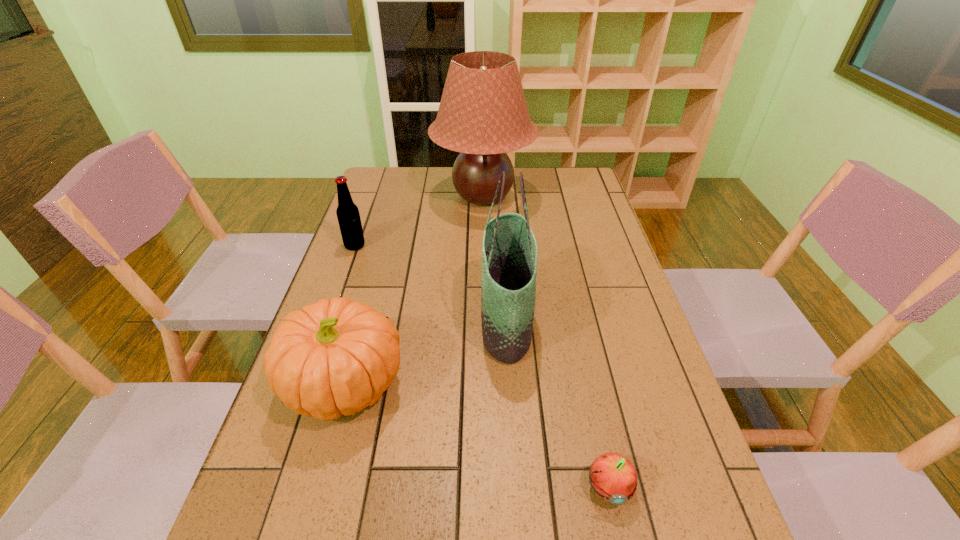
Where is `free region located on the back of the beer bottle`? Image resolution: width=960 pixels, height=540 pixels. free region located on the back of the beer bottle is located at coordinates (378, 180).

Identify the location of vacant space located on the surface of the pumpkin. This screenshot has width=960, height=540. (513, 384).

Identify the location of vacant area located 0.180m on the left of the nearest object. This screenshot has height=540, width=960. (486, 487).

The height and width of the screenshot is (540, 960). I want to click on object located in the far edge section of the desktop, so click(483, 114).

Locate an element on the screen. beer bottle present at the left edge is located at coordinates (348, 216).

Where is `pumpkin situated at the left edge`? The width and height of the screenshot is (960, 540). pumpkin situated at the left edge is located at coordinates (337, 356).

Find the location of a particular element. This screenshot has width=960, height=540. object at the right edge is located at coordinates (613, 477).

I want to click on vacant space at the far edge of the desktop, so click(546, 190).

In the image, there is a desktop. At what (x,y) coordinates should I click in order to perform the action: click on vacant space at the left edge. Please return your answer as a coordinate pair (x, y). The height and width of the screenshot is (540, 960). Looking at the image, I should click on (285, 427).

Locate an element on the screen. This screenshot has height=540, width=960. free space at the right edge of the desktop is located at coordinates (681, 430).